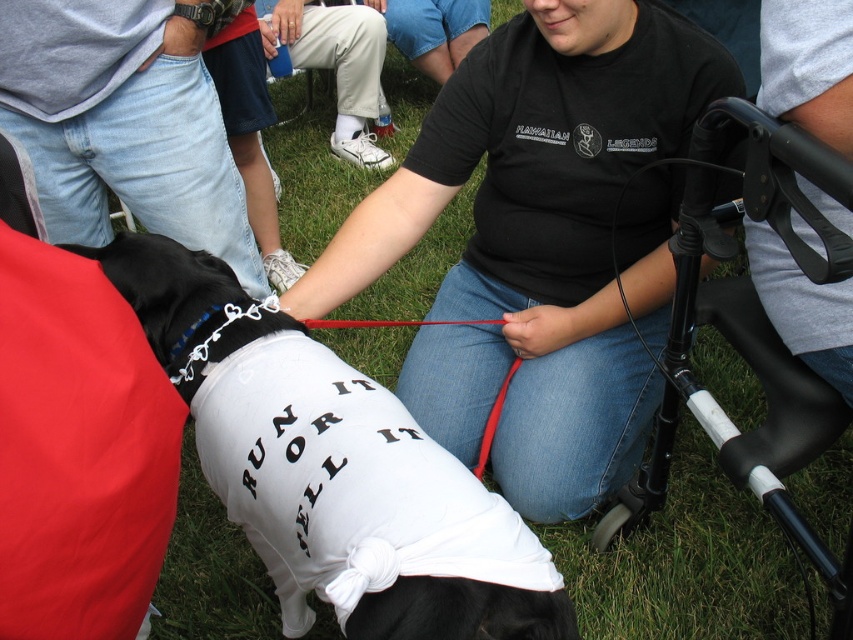
Question: Observing the image, what is the correct spatial positioning of black matte shirt at center in reference to blue jeans at left?

Choices:
 (A) left
 (B) right

Answer: (B)

Question: Which point appears farthest from the camera in this image?

Choices:
 (A) (619, 0)
 (B) (189, 324)
 (C) (83, 52)

Answer: (A)

Question: Is white fabric shirt at center wider than white fabric shoe at lower center?

Choices:
 (A) no
 (B) yes

Answer: (B)

Question: Which point is closer to the camera taking this photo?

Choices:
 (A) (280, 554)
 (B) (337, 56)

Answer: (A)

Question: Considering the relative positions of black matte shirt at center and white fabric shirt at center in the image provided, where is black matte shirt at center located with respect to white fabric shirt at center?

Choices:
 (A) left
 (B) right

Answer: (B)

Question: Estimate the real-world distances between objects in this image. Which object is farther from the blue jeans at left?

Choices:
 (A) white fabric shoe at lower center
 (B) black matte shirt at center

Answer: (A)